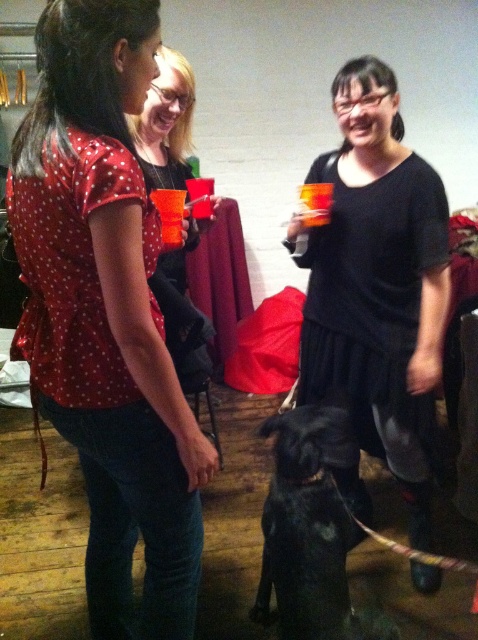
You are organizing a photo shoot and need to place a prop at the exact center of the image. The scene has a matte red blouse at center located at point (x=107, y=314). Where should you place the prop?

The exact center of the image is at point 0.5, 0.5. The matte red blouse at center is located at point (x=107, y=314), so the prop should be placed at 0.5, 0.5 to be at the true center.

You are a photographer at a party and want to capture a photo of the black matte dress at center and the black matte dog at center. Which one should you focus on if you want to highlight something taller in the frame?

The black matte dress at center is much taller than the black matte dog at center, so you should focus on the black matte dress at center to highlight the taller object.

You are at a party and want to know which of the two points, point (155, 556) or point (201, 339), is nearer to you. Can you determine this based on their positions?

Point (155, 556) is closer to the viewer than point (201, 339).